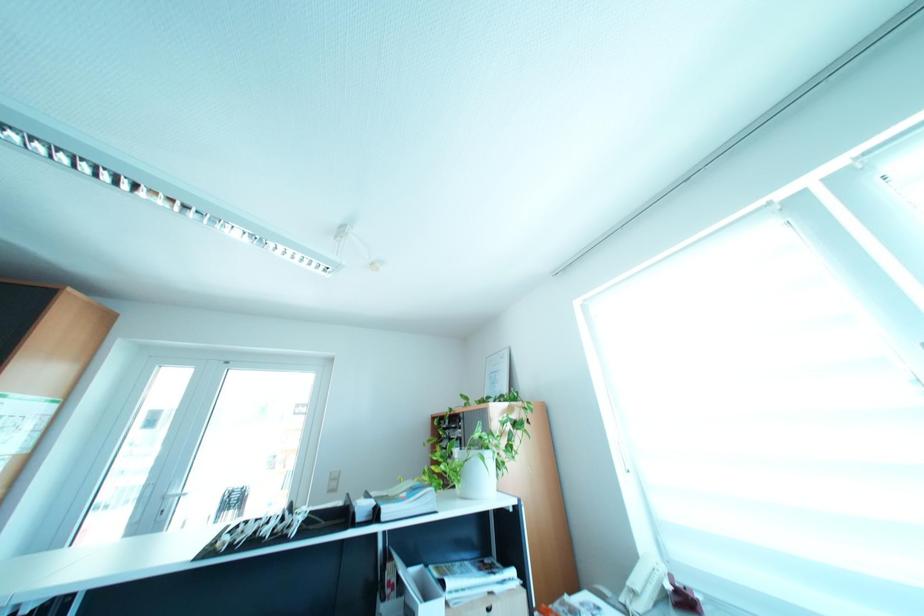
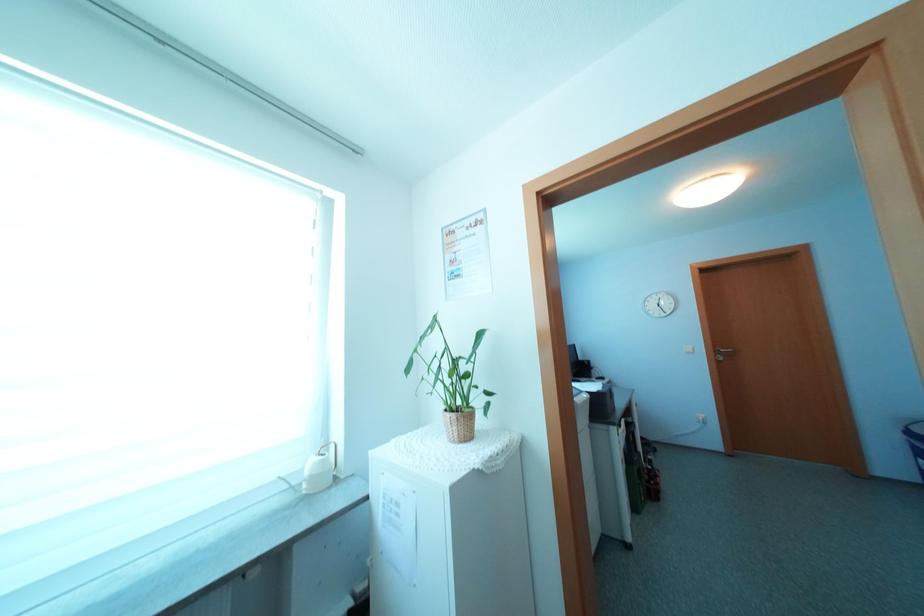
How did the camera likely rotate?

The camera's rotation is toward right-up.